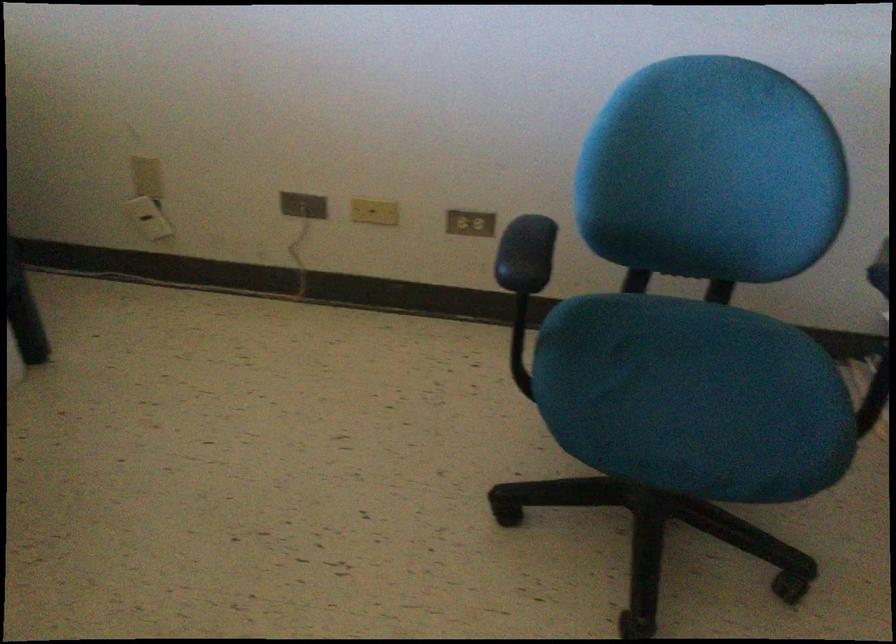
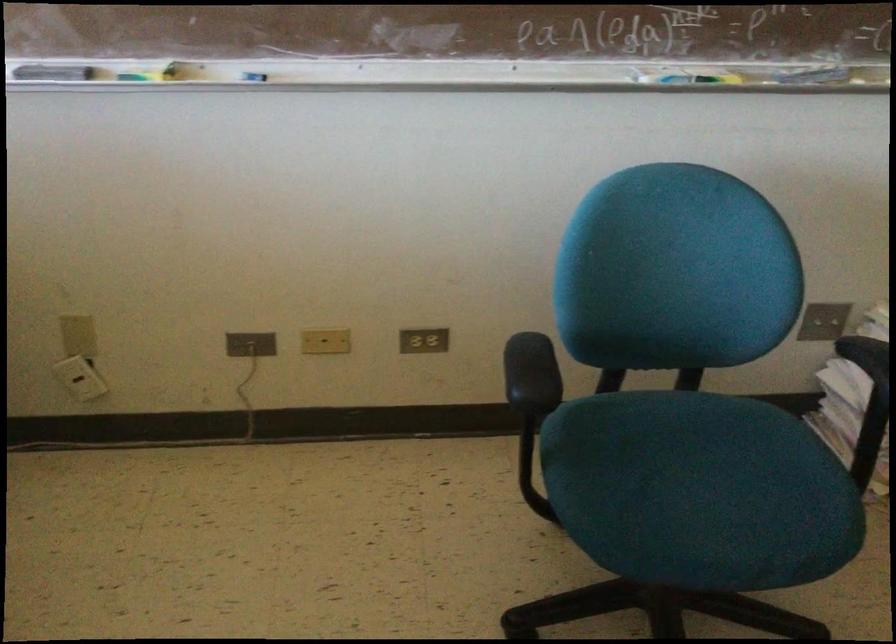
In the second image, find the point that corresponds to point (682, 397) in the first image.

(700, 491)